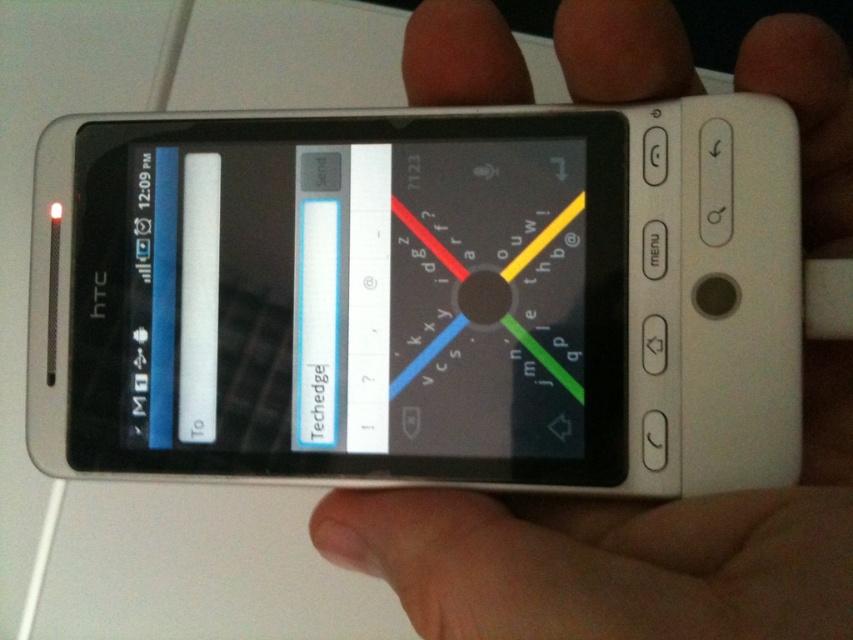
What do you see at coordinates (352, 298) in the screenshot? I see `satin white phone at center` at bounding box center [352, 298].

Can you confirm if satin white phone at center is positioned below white matte hand at center?

Incorrect, satin white phone at center is not positioned below white matte hand at center.

The image size is (853, 640). Describe the element at coordinates (352, 298) in the screenshot. I see `satin white phone at center` at that location.

Identify the location of satin white phone at center. Image resolution: width=853 pixels, height=640 pixels. (352, 298).